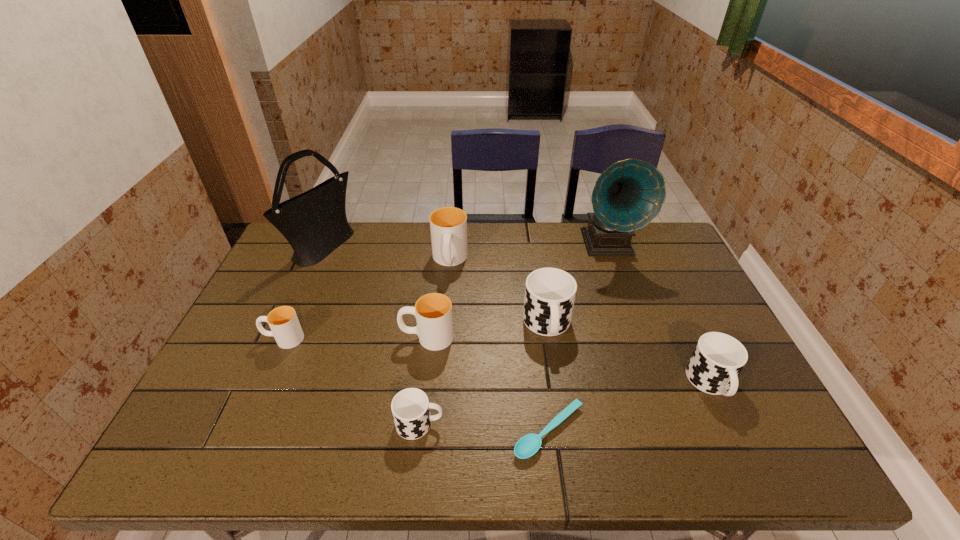
You are a GUI agent. You are given a task and a screenshot of the screen. Output one action in this format:
    pyautogui.click(x=<x>, y=<y>)
    Task: Click on the phonograph_record
    This screenshot has width=960, height=540.
    Given the screenshot: What is the action you would take?
    pyautogui.click(x=629, y=194)

What are the coordinates of `shoulder bag` in the screenshot? It's located at (314, 223).

In order to click on the farthest yellow cup in this screenshot , I will do `click(448, 225)`.

Identify the location of the biggest yellow cup. (448, 225).

Where is `the farthest black cup`? the farthest black cup is located at coordinates (550, 293).

This screenshot has width=960, height=540. In order to click on the second cup from right to left in this screenshot , I will do point(550,293).

Identify the location of the second biggest yellow cup. (433, 312).

I want to click on the rightmost cup, so click(x=717, y=360).

Where is `the second biggest black cup`? the second biggest black cup is located at coordinates (717, 360).

Identify the location of the leftmost yellow cup. click(x=284, y=324).